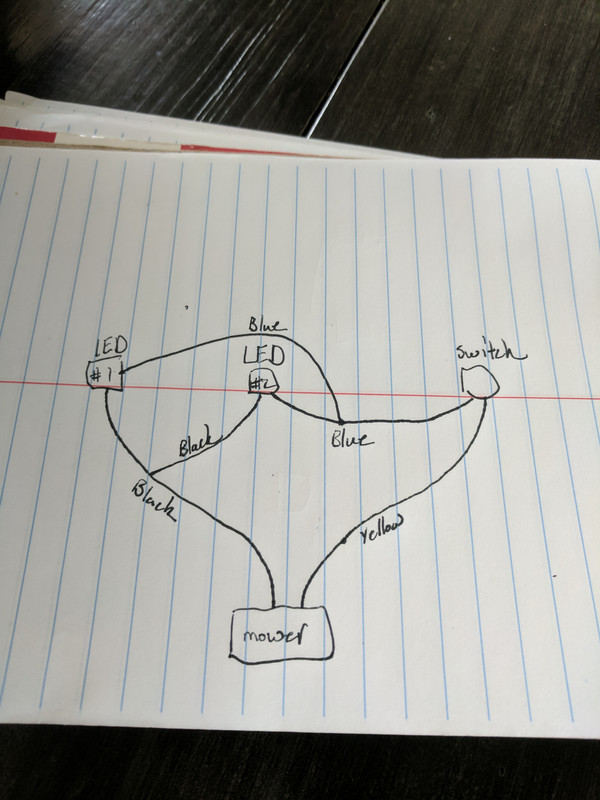
I want to click on led, so click(x=111, y=346).